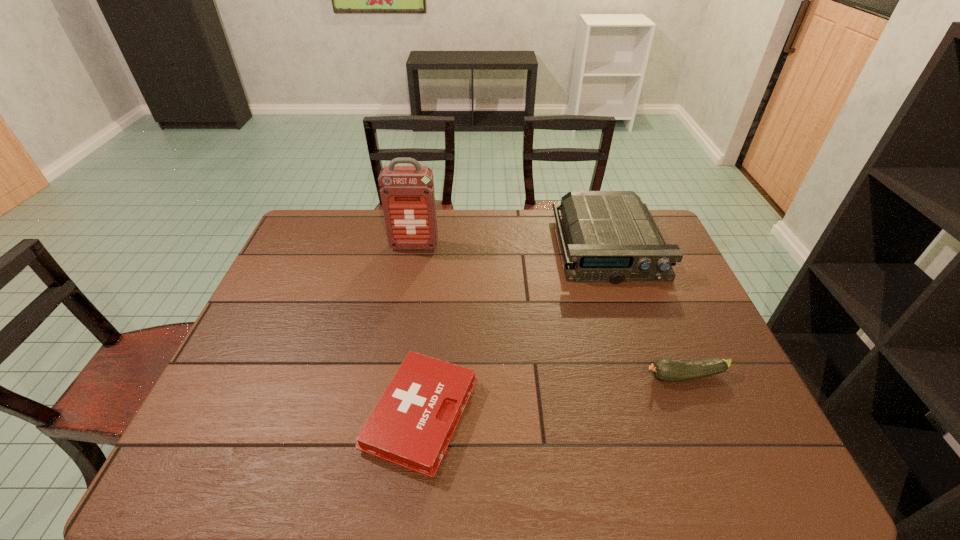
You are a GUI agent. You are given a task and a screenshot of the screen. Output one action in this format:
    pyautogui.click(x=<x>, y=<y>)
    Task: Click on the vacant space located 0.210m on the right of the nearer first-aid kit
    The width and height of the screenshot is (960, 540).
    Given the screenshot: What is the action you would take?
    pyautogui.click(x=566, y=415)

The height and width of the screenshot is (540, 960). Find the location of `the first-aid kit present at the far edge`. the first-aid kit present at the far edge is located at coordinates (407, 193).

You are a GUI agent. You are given a task and a screenshot of the screen. Output one action in this format:
    pyautogui.click(x=<x>, y=<y>)
    Task: Click on the radio receiver located in the far edge section of the desktop
    
    Given the screenshot: What is the action you would take?
    pyautogui.click(x=612, y=237)

At what (x,y) coordinates should I click in order to perform the action: click on object at the near edge. Please return your answer as a coordinate pair (x, y). This screenshot has height=540, width=960. Looking at the image, I should click on (411, 426).

Locate an element on the screen. The height and width of the screenshot is (540, 960). radio receiver at the right edge is located at coordinates [x=612, y=237].

What are the coordinates of `zucchini that is at the right edge` in the screenshot? It's located at (665, 369).

Identify the location of object that is at the far right corner. (612, 237).

What are the coordinates of `free space at the far edge of the desktop` in the screenshot? It's located at (448, 228).

The height and width of the screenshot is (540, 960). Identify the location of free space at the near edge. (535, 476).

This screenshot has width=960, height=540. In the image, there is a desktop. Find the location of `vacant region at the left edge`. vacant region at the left edge is located at coordinates (291, 296).